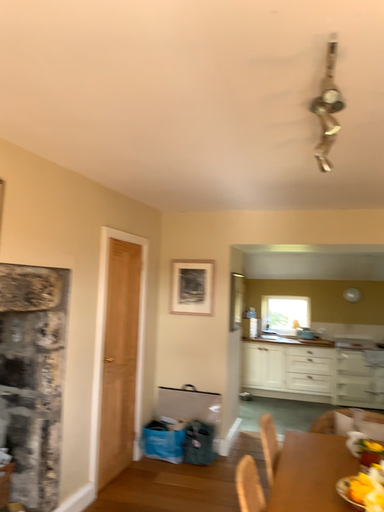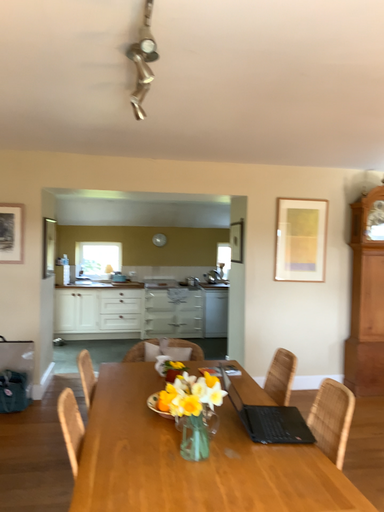
Question: How did the camera likely rotate when shooting the video?

Choices:
 (A) rotated left
 (B) rotated right

Answer: (B)